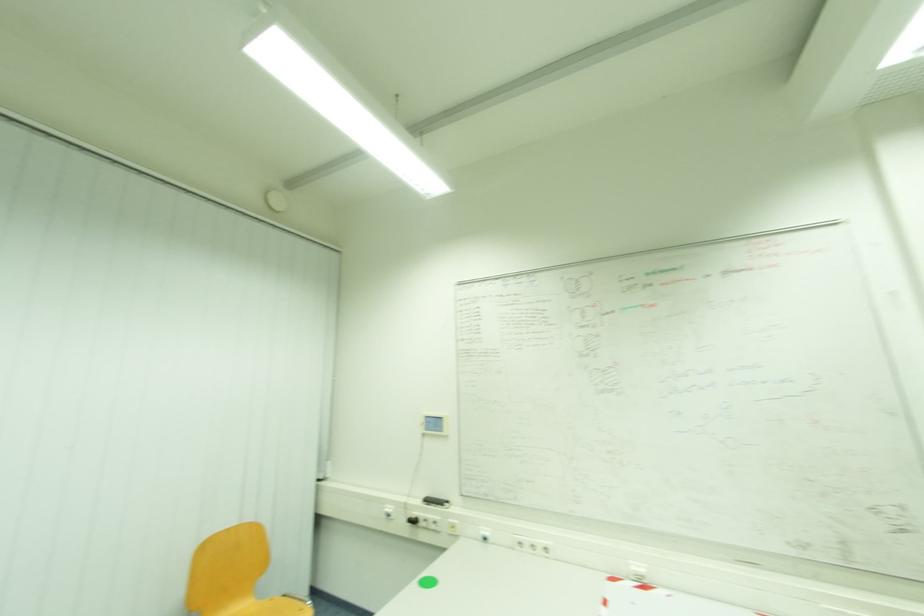
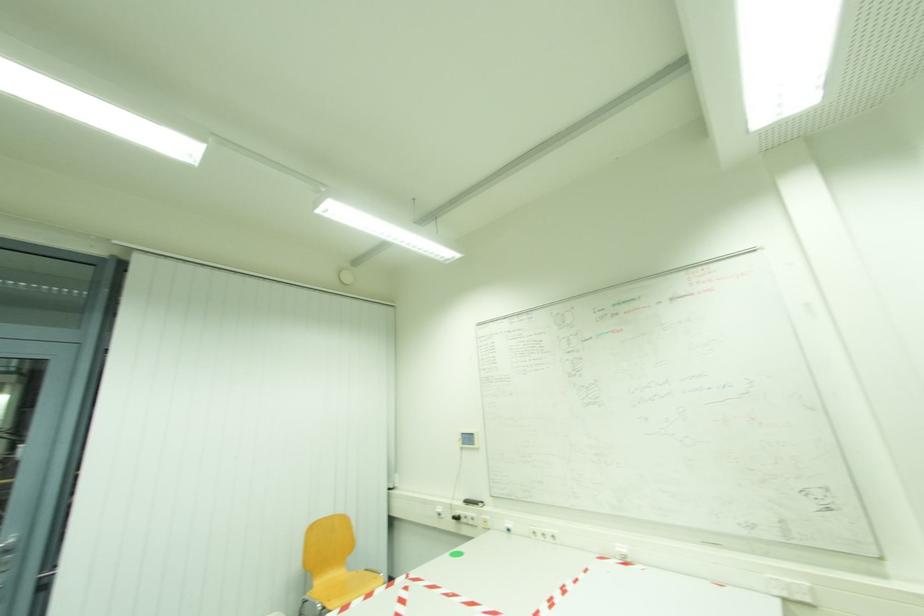
Question: The images are taken continuously from a first-person perspective. In which direction is your viewpoint rotating?

Choices:
 (A) Left
 (B) Right
 (C) Up
 (D) Down

Answer: (A)